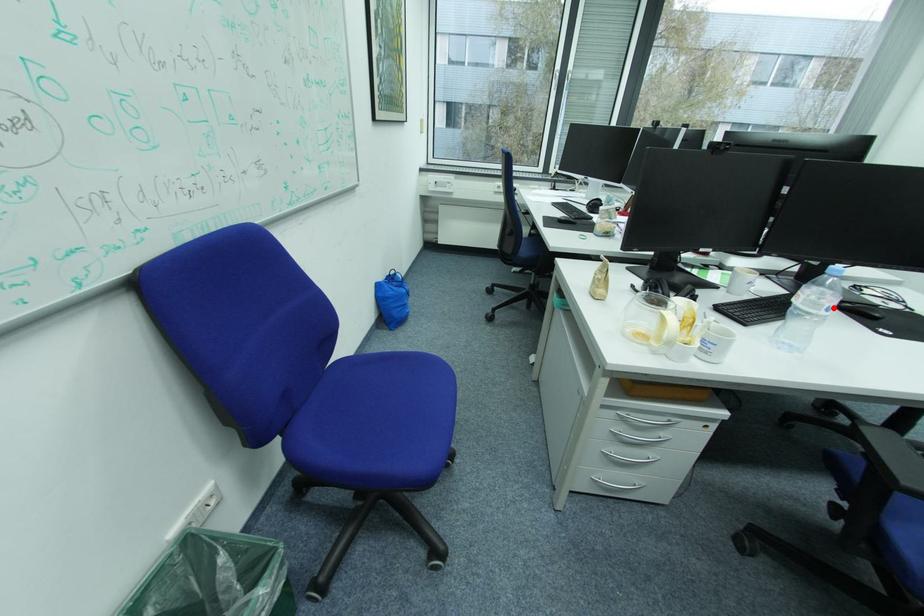
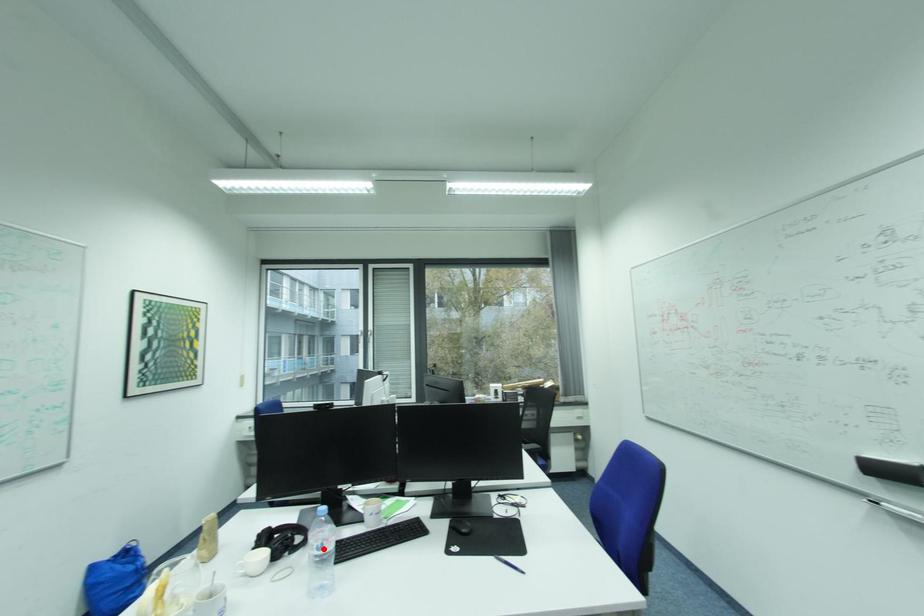
I am providing you with two images of the same scene from different viewpoints. A red point is marked on the first image and another point is marked on the second image. Does the point marked in image1 correspond to the same location as the one in image2?

Yes